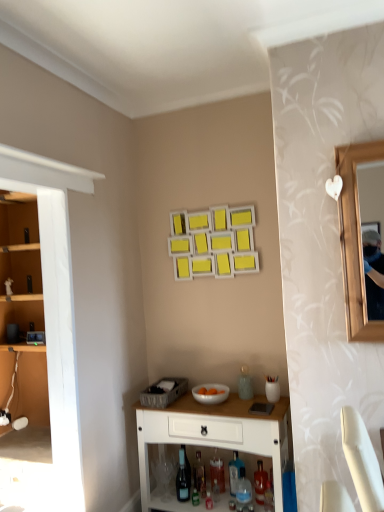
What are the coordinates of `translucent glass wine bottle at lower center` in the screenshot? It's located at (183, 478).

In the scene shown: In order to face white glossy bowl at lower center, should I rotate leftwards or rightwards?

It's best to rotate right around 2.671 degrees.

Identify the location of translucent glass bottle at lower center, placed as the 6th bottle when sorted from right to left. (196, 488).

Measure the distance between point (222, 490) and camera.

2.60 meters.

The image size is (384, 512). Find the location of `translucent glass bottle at lower center, the 4th bottle in the left-to-right sequence`. translucent glass bottle at lower center, the 4th bottle in the left-to-right sequence is located at coordinates (234, 472).

At what (x,y) coordinates should I click in order to perform the action: click on translucent glass wine bottle at lower center. Please return your answer as a coordinate pair (x, y). This screenshot has height=512, width=384. Looking at the image, I should click on (183, 478).

Considering the relative positions of translucent glass wine bottle at lower center and translucent glass bottle at center, the third bottle when ordered from left to right, in the image provided, is translucent glass wine bottle at lower center behind translucent glass bottle at center, the third bottle when ordered from left to right,?

No, translucent glass wine bottle at lower center is closer to the camera.

Is translucent glass wine bottle at lower center looking in the opposite direction of translucent glass bottle at center, the 4th bottle viewed from the right?

That's not correct — translucent glass wine bottle at lower center is not looking away from translucent glass bottle at center, the 4th bottle viewed from the right.

Who is taller, translucent glass wine bottle at lower center or translucent glass bottle at center, the third bottle when ordered from left to right?

With more height is translucent glass wine bottle at lower center.

Consider the image. Is translucent glass wine bottle at lower center at the right side of translucent glass bottle at center, the third bottle when ordered from left to right?

No, translucent glass wine bottle at lower center is not to the right of translucent glass bottle at center, the third bottle when ordered from left to right.

Can you confirm if translucent glass bottle at center, the third bottle when ordered from left to right, is shorter than white glossy bowl at lower center?

No, translucent glass bottle at center, the third bottle when ordered from left to right, is not shorter than white glossy bowl at lower center.

Considering the sizes of objects translucent glass bottle at center, the 4th bottle viewed from the right, and white glossy bowl at lower center in the image provided, who is bigger, translucent glass bottle at center, the 4th bottle viewed from the right, or white glossy bowl at lower center?

white glossy bowl at lower center is bigger.

From a real-world perspective, does translucent glass bottle at center, the 4th bottle viewed from the right, sit lower than white glossy bowl at lower center?

Yes, from a real-world perspective, translucent glass bottle at center, the 4th bottle viewed from the right, is under white glossy bowl at lower center.

Can you confirm if translucent glass bottle at center, the 4th bottle viewed from the right, is thinner than white glossy bowl at lower center?

Yes.

From the image's perspective, which is above, translucent glass wine bottle at lower center or translucent glass bottle at lower center, the 4th bottle in the left-to-right sequence?

From the image's view, translucent glass wine bottle at lower center is above.

Is translucent glass wine bottle at lower center closer to camera compared to translucent glass bottle at lower center, the third bottle positioned from the right?

Yes.

Considering the sizes of objects translucent glass wine bottle at lower center and translucent glass bottle at lower center, the third bottle positioned from the right, in the image provided, who is bigger, translucent glass wine bottle at lower center or translucent glass bottle at lower center, the third bottle positioned from the right,?

Bigger between the two is translucent glass bottle at lower center, the third bottle positioned from the right.

Would you say translucent glass bottle at center, the 4th bottle viewed from the right, is outside translucent glass bottle at lower center, which appears as the 1th bottle when viewed from the right?

That's correct, translucent glass bottle at center, the 4th bottle viewed from the right, is outside of translucent glass bottle at lower center, which appears as the 1th bottle when viewed from the right.

From a real-world perspective, which is physically above, translucent glass bottle at center, the 4th bottle viewed from the right, or translucent glass bottle at lower center, which is counted as the 6th bottle, starting from the left?

translucent glass bottle at center, the 4th bottle viewed from the right, from a real-world perspective.

Is point (220, 480) closer to camera compared to point (265, 482)?

That is False.

Is translucent glass bottle at center, the third bottle when ordered from left to right, bigger than translucent glass bottle at lower center, which appears as the 1th bottle when viewed from the right?

No, translucent glass bottle at center, the third bottle when ordered from left to right, is not bigger than translucent glass bottle at lower center, which appears as the 1th bottle when viewed from the right.

Is point (238, 477) more distant than point (202, 493)?

Yes.

Considering the relative sizes of translucent glass bottle at lower center, the third bottle positioned from the right, and translucent glass bottle at center, which ranks as the fifth bottle in right-to-left order, in the image provided, is translucent glass bottle at lower center, the third bottle positioned from the right, shorter than translucent glass bottle at center, which ranks as the fifth bottle in right-to-left order,?

Correct, translucent glass bottle at lower center, the third bottle positioned from the right, is not as tall as translucent glass bottle at center, which ranks as the fifth bottle in right-to-left order.

Is translucent glass bottle at lower center, the third bottle positioned from the right, facing towards translucent glass bottle at center, which ranks as the fifth bottle in right-to-left order?

No, translucent glass bottle at lower center, the third bottle positioned from the right, does not turn towards translucent glass bottle at center, which ranks as the fifth bottle in right-to-left order.

Consider the image. From the image's perspective, is white glossy bowl at lower center above or below translucent glass bottle at center, the 4th bottle viewed from the right?

Based on their image positions, white glossy bowl at lower center is located above translucent glass bottle at center, the 4th bottle viewed from the right.

Who is smaller, white glossy bowl at lower center or translucent glass bottle at center, the third bottle when ordered from left to right?

translucent glass bottle at center, the third bottle when ordered from left to right, is smaller.

Considering the positions of points (204, 385) and (214, 456), is point (204, 385) closer to camera compared to point (214, 456)?

No, (204, 385) is further to viewer.

From a real-world perspective, is translucent glass bottle at lower center, placed as the 6th bottle when sorted from right to left, positioned above or below translucent glass bottle at center, the 4th bottle viewed from the right?

Clearly, from a real-world perspective, translucent glass bottle at lower center, placed as the 6th bottle when sorted from right to left, is below translucent glass bottle at center, the 4th bottle viewed from the right.

Starting from the translucent glass bottle at lower center, placed as the 6th bottle when sorted from right to left, which bottle is the 2nd one to the right? Please provide its 2D coordinates.

[(217, 472)]

Does translucent glass bottle at lower center, the first bottle viewed from the left, have a lesser width compared to translucent glass bottle at center, the third bottle when ordered from left to right?

Incorrect, the width of translucent glass bottle at lower center, the first bottle viewed from the left, is not less than that of translucent glass bottle at center, the third bottle when ordered from left to right.

Identify the location of wine bottle above the translucent glass bottle at center, the 4th bottle viewed from the right (from a real-world perspective). This screenshot has width=384, height=512. (x=183, y=478).

This screenshot has width=384, height=512. Find the location of `bowl to the left of translucent glass bottle at center, the third bottle when ordered from left to right`. bowl to the left of translucent glass bottle at center, the third bottle when ordered from left to right is located at coordinates (210, 393).

Which object lies nearer to the anchor point white glossy cabinet at lower center, translucent glass wine bottle at lower center or translucent glass bottle at lower center, the first bottle viewed from the left?

translucent glass wine bottle at lower center.

Consider the image. Based on their spatial positions, is translucent glass wine bottle at lower center or translucent glass bottle at center, the third bottle when ordered from left to right, further from translucent glass bottle at lower center, placed as the 6th bottle when sorted from right to left?

The object further to translucent glass bottle at lower center, placed as the 6th bottle when sorted from right to left, is translucent glass bottle at center, the third bottle when ordered from left to right.

Looking at the image, which one is located closer to translucent glass bottle at lower center, placed as the 6th bottle when sorted from right to left, translucent glass bottle at center, the second bottle in the left-to-right sequence, or translucent glass bottle at lower center, which is counted as the 6th bottle, starting from the left?

translucent glass bottle at center, the second bottle in the left-to-right sequence, is closer to translucent glass bottle at lower center, placed as the 6th bottle when sorted from right to left.

Considering their positions, is translucent glass bottle at lower center, the third bottle positioned from the right, positioned closer to translucent glass wine bottle at lower center than translucent plastic bottle at lower center, the fifth bottle when ordered from left to right?

Based on the image, translucent glass bottle at lower center, the third bottle positioned from the right, appears to be nearer to translucent glass wine bottle at lower center.

Which object lies further to the anchor point translucent glass bottle at lower center, the third bottle positioned from the right, translucent glass bottle at lower center, which appears as the 1th bottle when viewed from the right, or translucent glass wine bottle at lower center?

translucent glass wine bottle at lower center.

Based on their spatial positions, is white glossy cabinet at lower center or translucent plastic bottle at lower center, positioned as the 2th bottle in right-to-left order, closer to translucent glass bottle at lower center, the first bottle viewed from the left?

translucent plastic bottle at lower center, positioned as the 2th bottle in right-to-left order, is closer to translucent glass bottle at lower center, the first bottle viewed from the left.

Looking at the image, which one is located further to translucent glass bottle at lower center, the 4th bottle in the left-to-right sequence, translucent glass bottle at center, the 4th bottle viewed from the right, or translucent glass bottle at lower center, placed as the 6th bottle when sorted from right to left?

translucent glass bottle at lower center, placed as the 6th bottle when sorted from right to left, is positioned further to the anchor translucent glass bottle at lower center, the 4th bottle in the left-to-right sequence.

Which object lies nearer to the anchor point translucent plastic bottle at lower center, positioned as the 2th bottle in right-to-left order, translucent glass bottle at center, the 4th bottle viewed from the right, or translucent glass bottle at lower center, the 4th bottle in the left-to-right sequence?

Based on the image, translucent glass bottle at lower center, the 4th bottle in the left-to-right sequence, appears to be nearer to translucent plastic bottle at lower center, positioned as the 2th bottle in right-to-left order.

Find the location of a particular element. The width and height of the screenshot is (384, 512). desk between white glossy bowl at lower center and translucent glass bottle at lower center, the third bottle positioned from the right, from top to bottom is located at coordinates (213, 436).

Locate an element on the screen. The height and width of the screenshot is (512, 384). desk between white glossy bowl at lower center and translucent glass bottle at center, the second bottle in the left-to-right sequence, in the vertical direction is located at coordinates (213, 436).

You are a GUI agent. You are given a task and a screenshot of the screen. Output one action in this format:
    pyautogui.click(x=<x>, y=<y>)
    Task: Click on the desk between white glossy bowl at lower center and translucent glass wine bottle at lower center vertically
    This screenshot has height=512, width=384.
    Given the screenshot: What is the action you would take?
    pyautogui.click(x=213, y=436)

At what (x,y) coordinates should I click in order to perform the action: click on wine bottle between white glossy bowl at lower center and translucent glass bottle at center, which ranks as the fifth bottle in right-to-left order, in the vertical direction. Please return your answer as a coordinate pair (x, y). The width and height of the screenshot is (384, 512). Looking at the image, I should click on (183, 478).